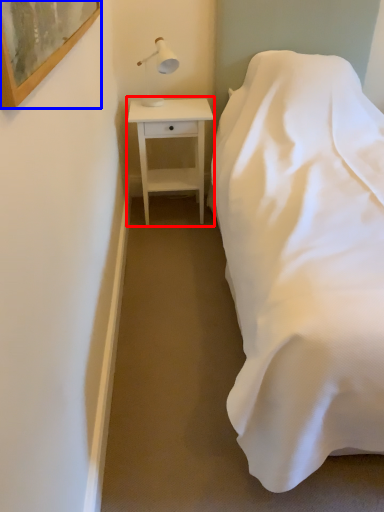
Question: Which point is closer to the camera, nightstand (highlighted by a red box) or picture frame (highlighted by a blue box)?

Choices:
 (A) nightstand
 (B) picture frame

Answer: (B)